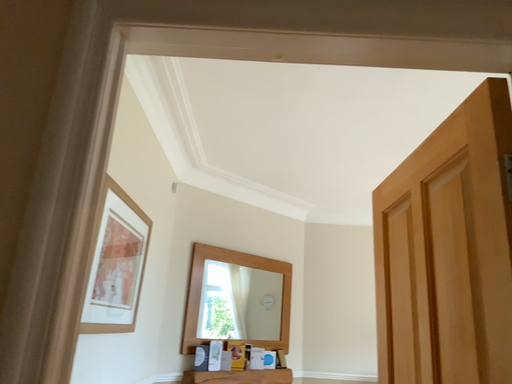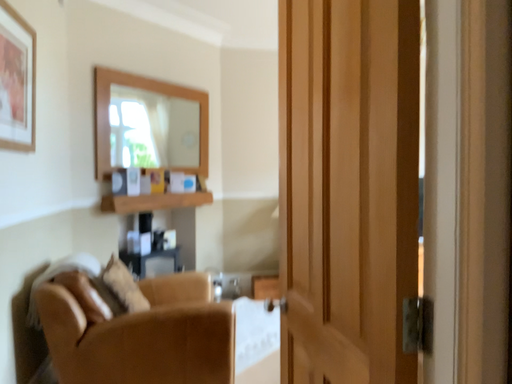
Question: Which way did the camera rotate in the video?

Choices:
 (A) rotated right
 (B) rotated left

Answer: (A)